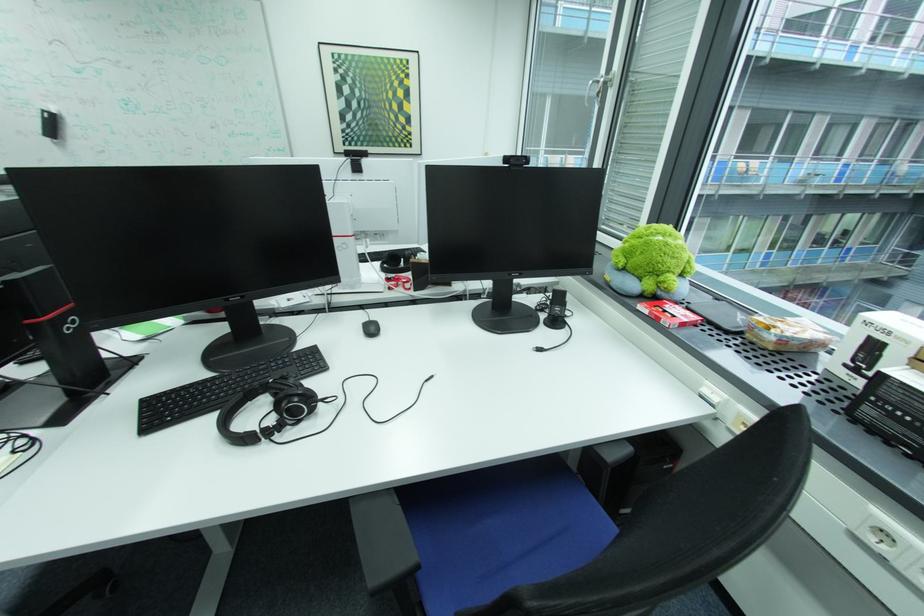
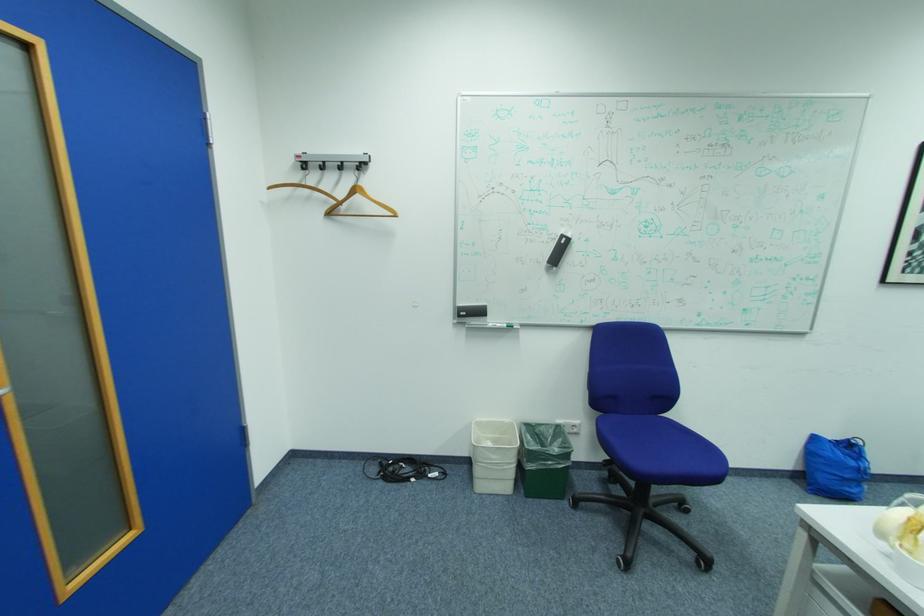
Question: What movement of the cameraman would produce the second image?

Choices:
 (A) Left
 (B) Right
 (C) Forward
 (D) Backward

Answer: (A)